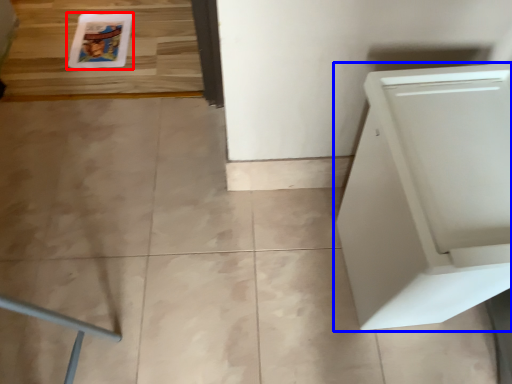
Question: Which point is closer to the camera, comic book (highlighted by a red box) or home appliance (highlighted by a blue box)?

Choices:
 (A) comic book
 (B) home appliance

Answer: (B)